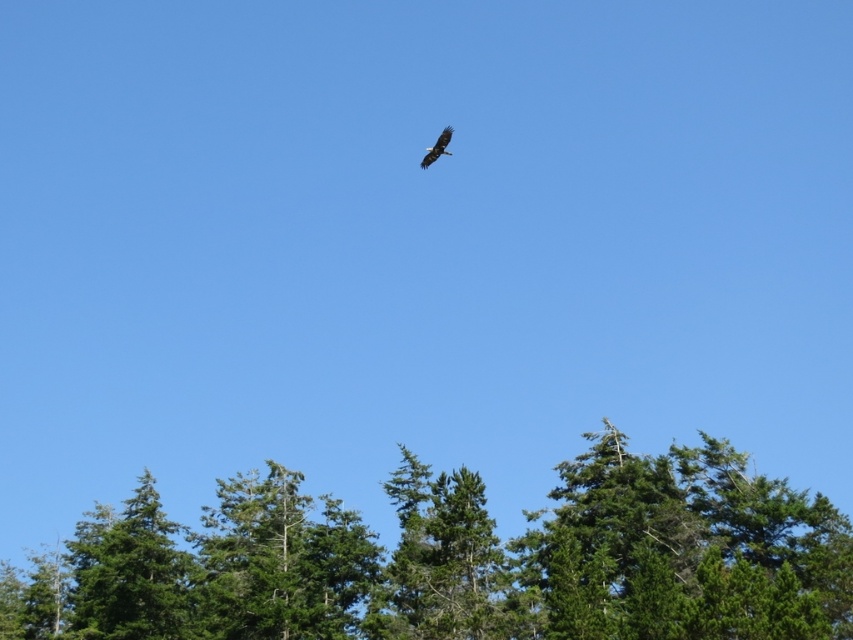
Question: Which point is farther to the camera?

Choices:
 (A) (746, 484)
 (B) (424, 163)

Answer: (A)

Question: Can you confirm if green textured tree at center is bigger than dark brown eagle at upper center?

Choices:
 (A) yes
 (B) no

Answer: (A)

Question: Is green textured tree at center below dark brown eagle at upper center?

Choices:
 (A) yes
 (B) no

Answer: (A)

Question: Is green textured tree at center wider than dark brown eagle at upper center?

Choices:
 (A) yes
 (B) no

Answer: (A)